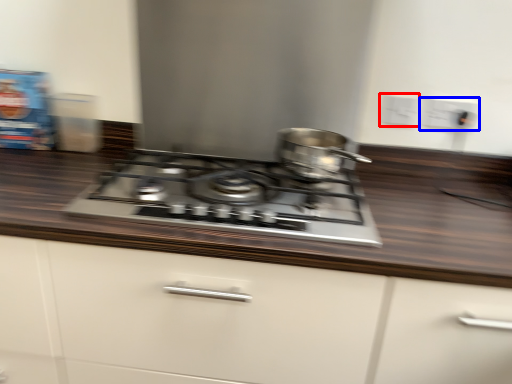
Question: Which object appears farthest to the camera in this image, electric outlet (highlighted by a red box) or electric outlet (highlighted by a blue box)?

Choices:
 (A) electric outlet
 (B) electric outlet

Answer: (A)